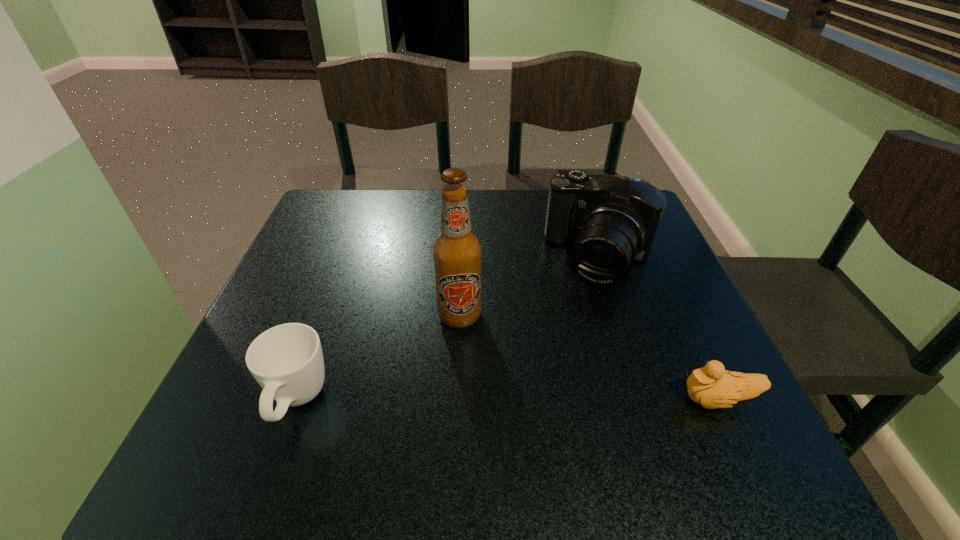
This screenshot has width=960, height=540. Identify the location of vacant space on the desktop that is between the leftmost object and the duckling and is positioned on the lens of the camera. (530, 401).

Where is `vacant space on the desktop that is between the cup and the shortest object and is positioned on the front label of the tallest object`? vacant space on the desktop that is between the cup and the shortest object and is positioned on the front label of the tallest object is located at coordinates (447, 401).